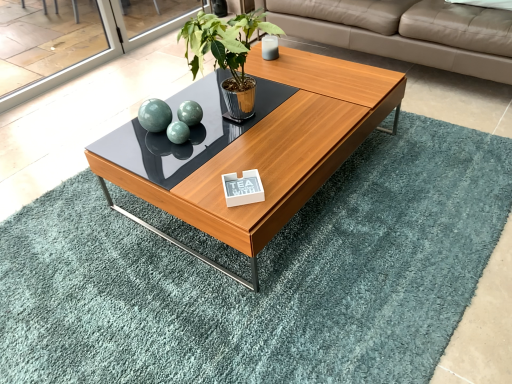
Question: Should I look upward or downward to see teal rug at center?

Choices:
 (A) down
 (B) up

Answer: (A)

Question: Considering the relative sizes of wooden coffee table at center and green leafy plant at center in the image provided, is wooden coffee table at center smaller than green leafy plant at center?

Choices:
 (A) no
 (B) yes

Answer: (A)

Question: Is wooden coffee table at center completely or partially outside of green leafy plant at center?

Choices:
 (A) no
 (B) yes

Answer: (B)

Question: Is the position of wooden coffee table at center more distant than that of green leafy plant at center?

Choices:
 (A) yes
 (B) no

Answer: (B)

Question: Could green leafy plant at center be considered to be inside wooden coffee table at center?

Choices:
 (A) no
 (B) yes

Answer: (A)

Question: Is wooden coffee table at center aimed at green leafy plant at center?

Choices:
 (A) yes
 (B) no

Answer: (B)

Question: Would you say wooden coffee table at center is a long distance from green leafy plant at center?

Choices:
 (A) yes
 (B) no

Answer: (B)

Question: Considering the relative sizes of white glossy plaque at center and teal rug at center in the image provided, is white glossy plaque at center smaller than teal rug at center?

Choices:
 (A) no
 (B) yes

Answer: (B)

Question: Does white glossy plaque at center turn towards teal rug at center?

Choices:
 (A) no
 (B) yes

Answer: (A)

Question: Is white glossy plaque at center to the left of teal rug at center from the viewer's perspective?

Choices:
 (A) no
 (B) yes

Answer: (B)

Question: Is white glossy plaque at center positioned with its back to teal rug at center?

Choices:
 (A) no
 (B) yes

Answer: (A)

Question: Does white glossy plaque at center have a lesser height compared to teal rug at center?

Choices:
 (A) no
 (B) yes

Answer: (B)

Question: From a real-world perspective, is white glossy plaque at center below teal rug at center?

Choices:
 (A) no
 (B) yes

Answer: (A)

Question: Is beige leather couch at upper right placed right next to white glossy plaque at center?

Choices:
 (A) no
 (B) yes

Answer: (A)